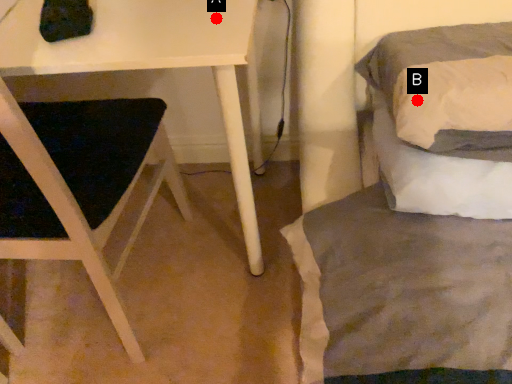
Question: Two points are circled on the image, labeled by A and B beside each circle. Which point is farther from the camera taking this photo?

Choices:
 (A) A is further
 (B) B is further

Answer: (A)